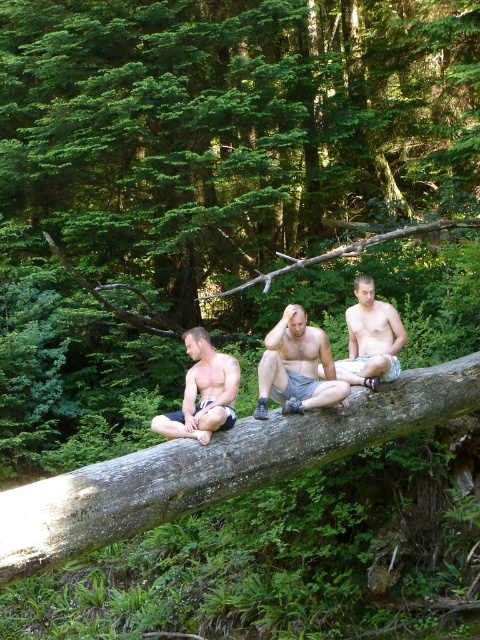
You are standing in the forest scene and want to place a small decoration between the two points, point [243,444] and point [358,308]. Which point should you place it closer to if you want the decoration to be more visible to someone looking from the front?

You should place the decoration closer to point [243,444] because it is closer to the viewer than point [358,308], making it more visible from the front.

You are an observer in the forest scene. You notice the shiny metallic shorts at center and the light brown wood log at center. Which object is narrower in width?

The shiny metallic shorts at center has a lesser width compared to the light brown wood log at center, so the shiny metallic shorts at center is narrower.

You are planning to use the gray rough log at center and the light brown wood log at center for a campfire. Which log would you choose if you want the one that is larger in size?

The gray rough log at center is bigger than the light brown wood log at center, so you should choose the gray rough log at center for a campfire if you want the larger one.